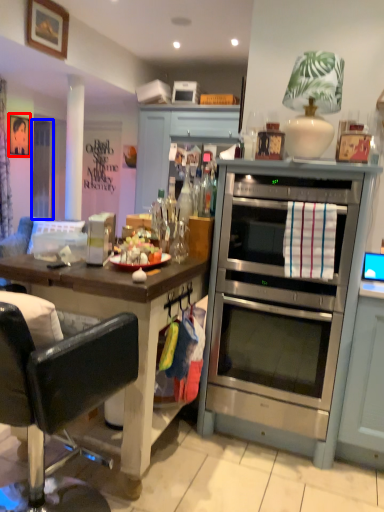
Question: Which object is further to the camera taking this photo, picture frame (highlighted by a red box) or glass door (highlighted by a blue box)?

Choices:
 (A) picture frame
 (B) glass door

Answer: (B)